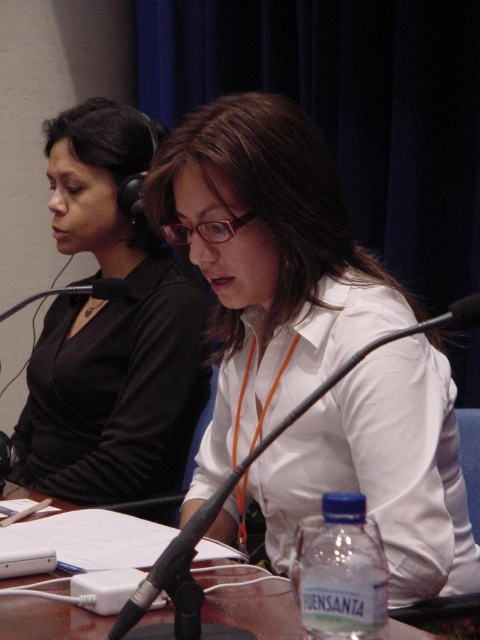
Is matte black shirt at center to the left of brown wooden table at center from the viewer's perspective?

Indeed, matte black shirt at center is positioned on the left side of brown wooden table at center.

The width and height of the screenshot is (480, 640). What do you see at coordinates (111, 326) in the screenshot?
I see `matte black shirt at center` at bounding box center [111, 326].

At what (x,y) coordinates should I click in order to perform the action: click on matte black shirt at center. Please return your answer as a coordinate pair (x, y). The image size is (480, 640). Looking at the image, I should click on (111, 326).

Can you confirm if white glossy shirt at center is smaller than matte black shirt at center?

Yes.

In the scene shown: Who is more forward, (x=408, y=449) or (x=95, y=500)?

Positioned in front is point (x=408, y=449).

At what (x,y) coordinates should I click in order to perform the action: click on white glossy shirt at center. Please return your answer as a coordinate pair (x, y). This screenshot has height=640, width=480. Looking at the image, I should click on (266, 266).

Is white glossy shirt at center behind brown wooden table at center?

Yes, white glossy shirt at center is behind brown wooden table at center.

Measure the distance between point [217,378] and camera.

Point [217,378] is 4.89 feet away from camera.

Is point (294, 109) farther from camera compared to point (277, 588)?

Yes, point (294, 109) is behind point (277, 588).

In order to click on white glossy shirt at center in this screenshot , I will do `click(266, 266)`.